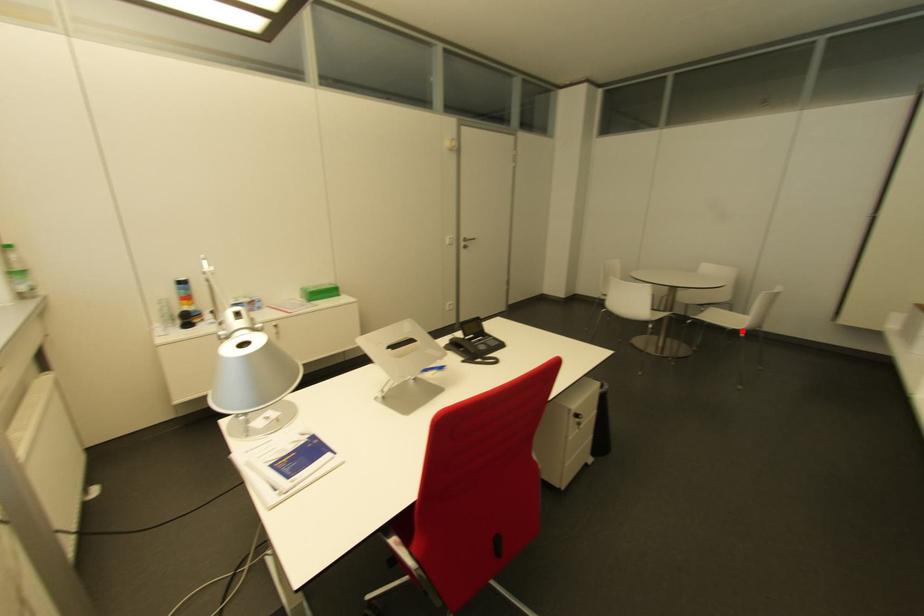
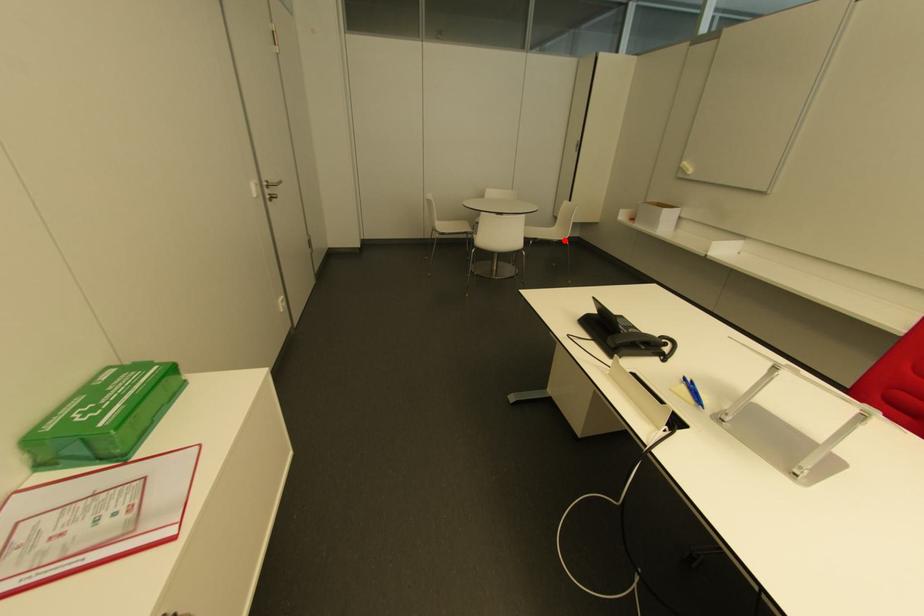
I am providing you with two images of the same scene from different viewpoints. A red point is marked on the first image and another point is marked on the second image. Do the highlighted points in image1 and image2 indicate the same real-world spot?

Yes